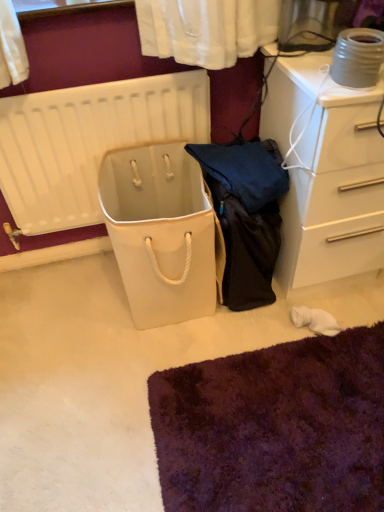
Identify the location of vacant area on top of white matte radiator at left (from a real-world perspective). Image resolution: width=384 pixels, height=512 pixels. (94, 79).